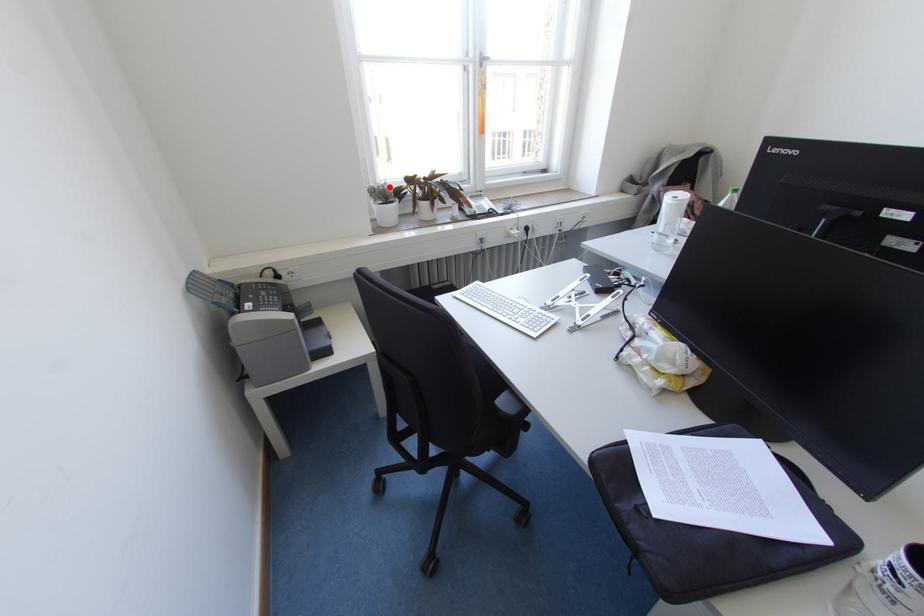
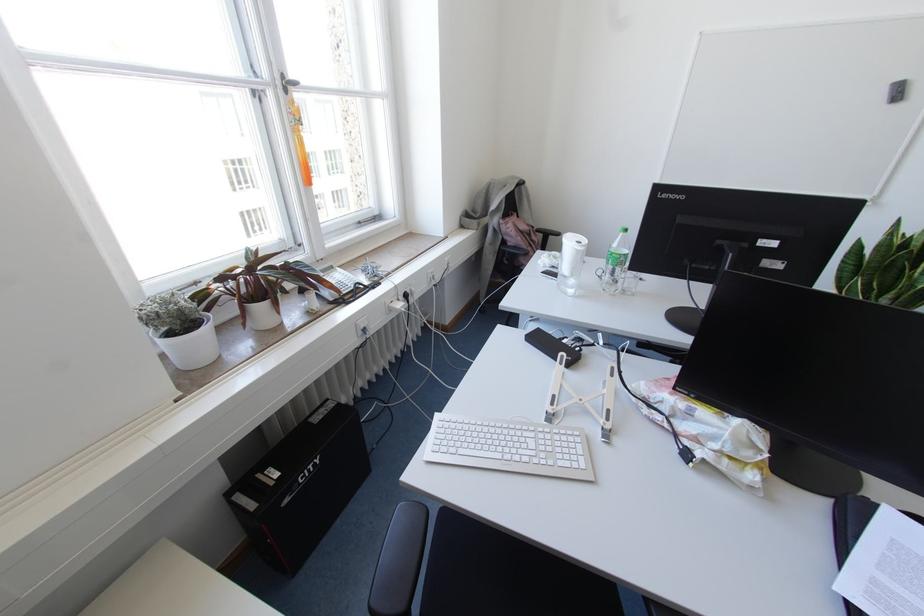
Question: I am providing you with two images of the same scene from different viewpoints. A red point is shown in image1. For the corresponding object point in image2, is it positioned nearer or farther from the camera?

Choices:
 (A) Nearer
 (B) Farther

Answer: (B)